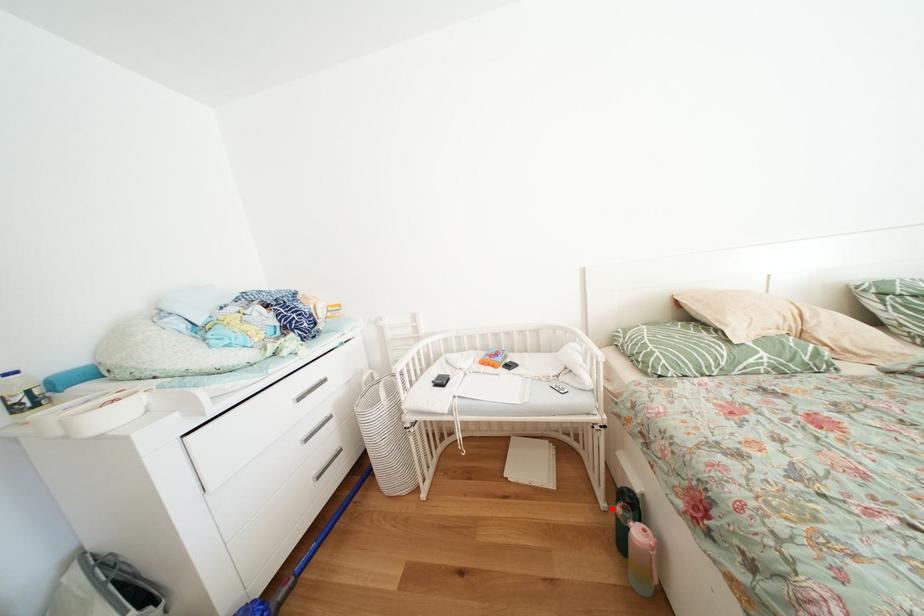
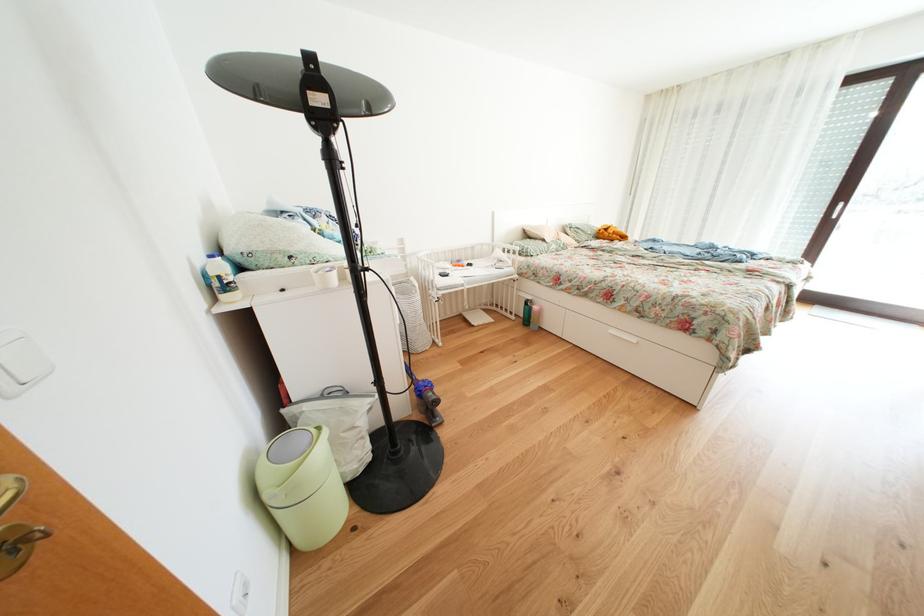
Question: I am providing you with two images of the same scene from different viewpoints. Given a red point in image1, look at the same physical point in image2. Is it:

Choices:
 (A) Closer to the viewpoint
 (B) Farther from the viewpoint

Answer: (B)